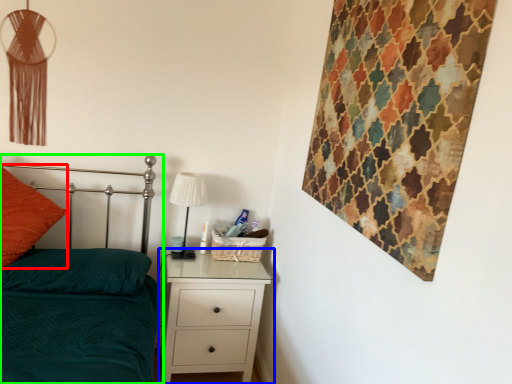
Question: Which object is the farthest from throw pillow (highlighted by a red box)? Choose among these: chest of drawers (highlighted by a blue box) or bed (highlighted by a green box).

Choices:
 (A) chest of drawers
 (B) bed

Answer: (A)